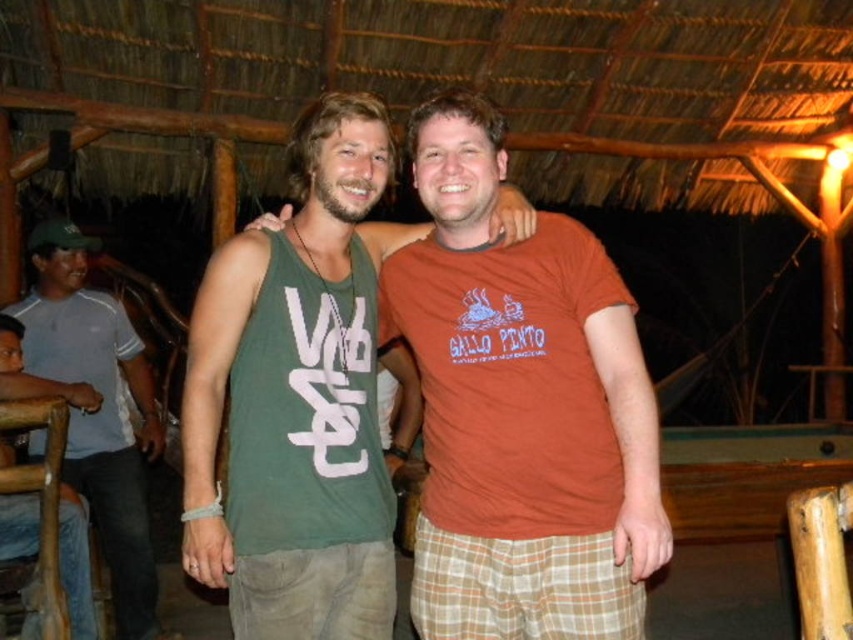
Question: Among these objects, which one is nearest to the camera?

Choices:
 (A) gray cotton shirt at left
 (B) green cotton tank top at center
 (C) jeans at left

Answer: (B)

Question: Can you confirm if gray cotton shirt at left is thinner than jeans at left?

Choices:
 (A) no
 (B) yes

Answer: (A)

Question: Considering the relative positions of green cotton tank top at center and jeans at left in the image provided, where is green cotton tank top at center located with respect to jeans at left?

Choices:
 (A) above
 (B) below

Answer: (A)

Question: Which point appears closest to the camera in this image?

Choices:
 (A) (305, 410)
 (B) (131, 620)
 (C) (7, 493)

Answer: (A)

Question: Observing the image, what is the correct spatial positioning of green cotton tank top at center in reference to jeans at left?

Choices:
 (A) above
 (B) below

Answer: (A)

Question: Which of the following is the closest to the observer?

Choices:
 (A) jeans at left
 (B) green cotton tank top at center

Answer: (B)